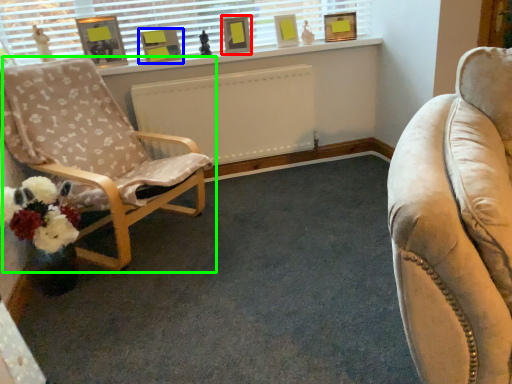
Question: Which object is positioned farthest from picture frame (highlighted by a red box)? Select from picture frame (highlighted by a blue box) and chair (highlighted by a green box).

Choices:
 (A) picture frame
 (B) chair

Answer: (B)